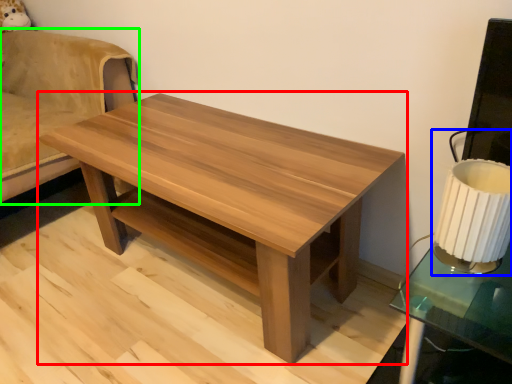
Question: Which object is positioned farthest from coffee table (highlighted by a red box)? Select from table lamp (highlighted by a blue box) and swivel chair (highlighted by a green box).

Choices:
 (A) table lamp
 (B) swivel chair

Answer: (B)